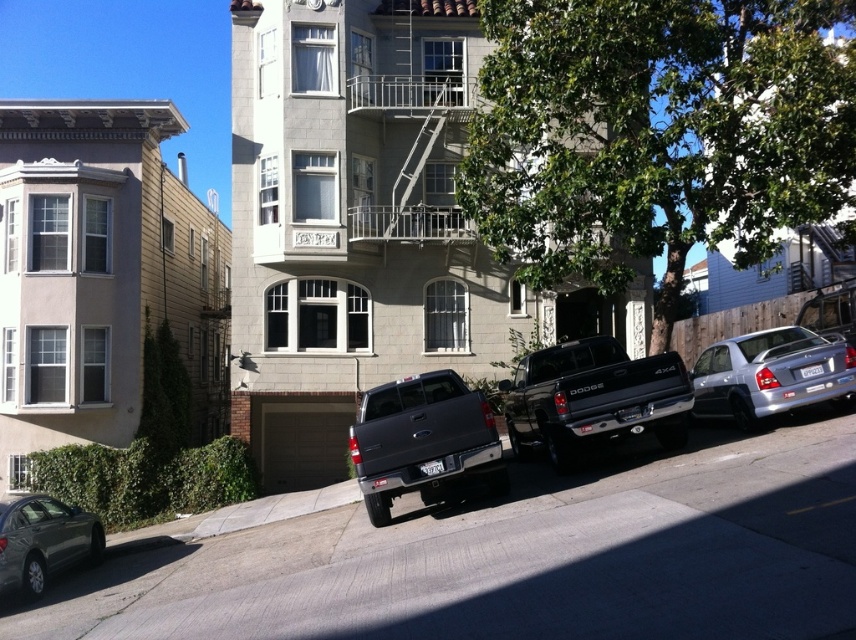
Image resolution: width=856 pixels, height=640 pixels. Describe the element at coordinates (593, 397) in the screenshot. I see `black matte truck at center` at that location.

Does black matte truck at center have a greater height compared to gray matte truck at center?

Yes.

You are a GUI agent. You are given a task and a screenshot of the screen. Output one action in this format:
    pyautogui.click(x=<x>, y=<y>)
    Task: Click on the black matte truck at center
    
    Given the screenshot: What is the action you would take?
    pyautogui.click(x=593, y=397)

Between gray matte truck at center and metallic gray sedan at lower left, which one appears on the left side from the viewer's perspective?

From the viewer's perspective, metallic gray sedan at lower left appears more on the left side.

Find the location of a particular element. This screenshot has height=640, width=856. gray matte truck at center is located at coordinates (423, 442).

Between point (486, 428) and point (724, 364), which one is positioned behind?

Point (724, 364)

Is gray matte truck at center smaller than silver metallic sedan at right?

Correct, gray matte truck at center occupies less space than silver metallic sedan at right.

Is point (385, 417) farther from camera compared to point (753, 349)?

No.

This screenshot has width=856, height=640. I want to click on gray matte truck at center, so (x=423, y=442).